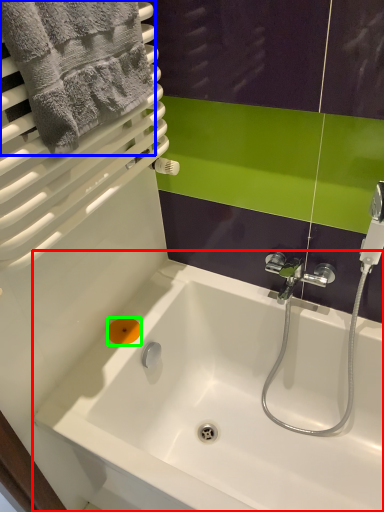
Question: Which object is the farthest from bathtub (highlighted by a red box)? Choose among these: towel (highlighted by a blue box) or soap (highlighted by a green box).

Choices:
 (A) towel
 (B) soap

Answer: (A)